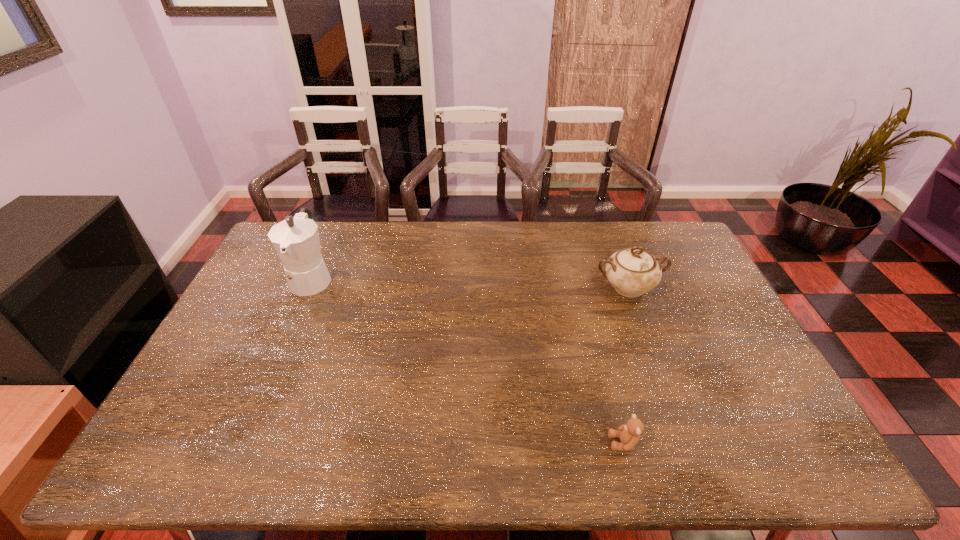
The height and width of the screenshot is (540, 960). I want to click on the leftmost object, so click(x=296, y=240).

What are the coordinates of `the tallest object` in the screenshot? It's located at (296, 240).

Find the location of `the second tallest object`. the second tallest object is located at coordinates (632, 272).

This screenshot has height=540, width=960. Find the location of `the rightmost object`. the rightmost object is located at coordinates (632, 272).

You are a GUI agent. You are given a task and a screenshot of the screen. Output one action in this format:
    pyautogui.click(x=<x>, y=<y>)
    Task: Click on the teddy bear
    The image size is (960, 540).
    Given the screenshot: What is the action you would take?
    pyautogui.click(x=629, y=433)

You are a GUI agent. You are given a task and a screenshot of the screen. Output one action in this format:
    pyautogui.click(x=<x>, y=<y>)
    Task: Click on the nearest object
    The height and width of the screenshot is (540, 960).
    Given the screenshot: What is the action you would take?
    pyautogui.click(x=629, y=433)

Locate an element on the screen. free location located at the spout of the leftmost object is located at coordinates (269, 375).

This screenshot has width=960, height=540. Find the location of `vacant space positioned on the left of the rightmost object`. vacant space positioned on the left of the rightmost object is located at coordinates (475, 288).

Locate an element on the screen. vacant space located 0.120m on the face of the shortest object is located at coordinates (559, 443).

The image size is (960, 540). Find the location of `vacant position located 0.110m on the face of the shortest object`. vacant position located 0.110m on the face of the shortest object is located at coordinates (563, 443).